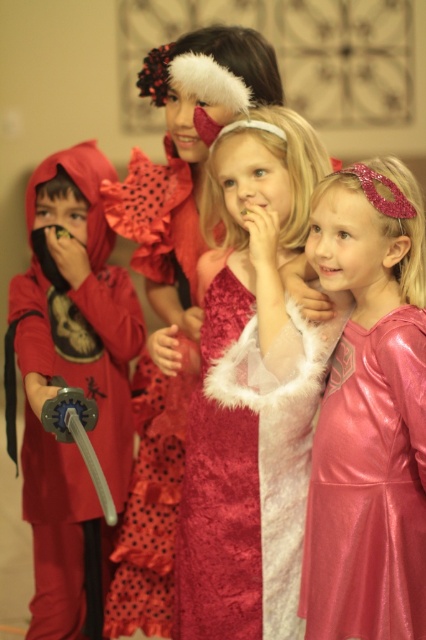
Question: Is matte red costume at left wider than fuzzy pink dress at center?

Choices:
 (A) yes
 (B) no

Answer: (B)

Question: Which of the following is the closest to the observer?

Choices:
 (A) fuzzy pink dress at center
 (B) matte red costume at left
 (C) shiny pink dress at center

Answer: (C)

Question: Which of these objects is positioned farthest from the matte red costume at left?

Choices:
 (A) fuzzy pink dress at center
 (B) shiny pink dress at center

Answer: (B)

Question: Does shiny pink dress at center come behind matte red costume at left?

Choices:
 (A) no
 (B) yes

Answer: (A)

Question: Does shiny pink dress at center appear on the right side of fuzzy pink dress at center?

Choices:
 (A) no
 (B) yes

Answer: (B)

Question: Which point is farther to the camera?

Choices:
 (A) (42, 456)
 (B) (376, 282)
 (C) (296, 460)

Answer: (A)